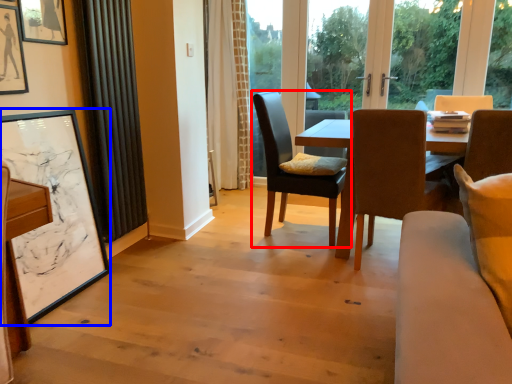
Question: Which point is closer to the camera, chair (highlighted by a red box) or picture frame (highlighted by a blue box)?

Choices:
 (A) chair
 (B) picture frame

Answer: (B)